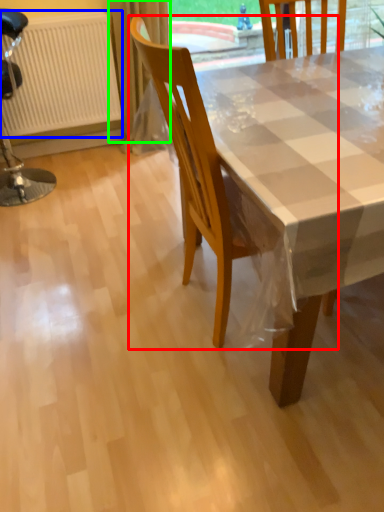
Question: Considering the real-world distances, which object is farthest from chair (highlighted by a red box)? radiator (highlighted by a blue box) or curtain (highlighted by a green box)?

Choices:
 (A) radiator
 (B) curtain

Answer: (A)